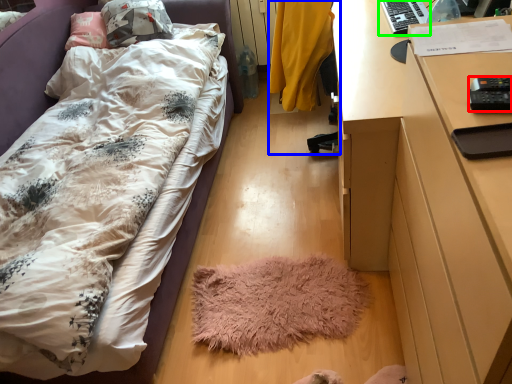
Question: Which object is positioned closest to remote control (highlighted by a red box)? Select from chair (highlighted by a blue box) and desktop (highlighted by a green box).

Choices:
 (A) chair
 (B) desktop

Answer: (B)